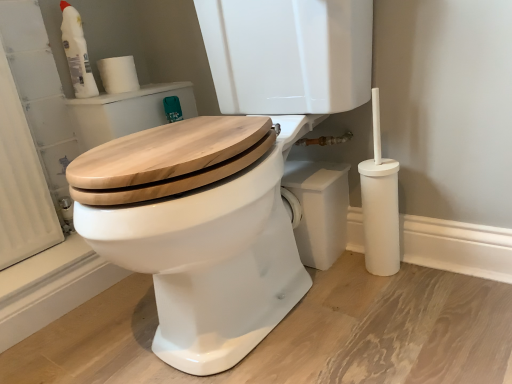
Question: Does point [74, 69] appear closer or farther from the camera than point [224, 11]?

Choices:
 (A) farther
 (B) closer

Answer: (A)

Question: From their relative heights in the image, would you say white plastic bottle at upper left is taller or shorter than wooden toilet seat at center?

Choices:
 (A) short
 (B) tall

Answer: (A)

Question: Which is nearer to the wooden toilet seat at center?

Choices:
 (A) white plastic bottle at upper left
 (B) white matte toilet paper at upper left

Answer: (B)

Question: Which of these objects is positioned closest to the wooden toilet seat at center?

Choices:
 (A) white matte toilet paper at upper left
 (B) white plastic bottle at upper left

Answer: (A)